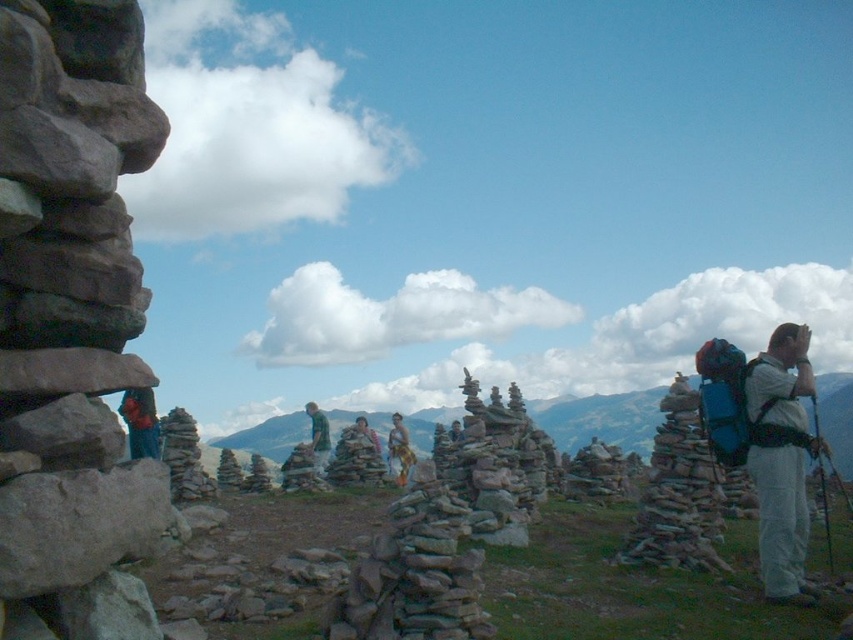
Question: Does white matte backpack at right have a larger size compared to blue fabric backpack at left?

Choices:
 (A) yes
 (B) no

Answer: (B)

Question: Estimate the real-world distances between objects in this image. Which object is farther from the white matte backpack at right?

Choices:
 (A) blue fabric backpack at left
 (B) gray stone stack at left
 (C) camouflage fabric jacket at center
 (D) camouflage fabric pants at center

Answer: (C)

Question: Does white matte backpack at right appear under camouflage fabric pants at center?

Choices:
 (A) no
 (B) yes

Answer: (A)

Question: Which point is farther to the camera?

Choices:
 (A) camouflage fabric jacket at center
 (B) gray stone stack at left
 (C) camouflage fabric pants at center

Answer: (A)

Question: Which point is closer to the camera?

Choices:
 (A) green fabric shirt at center
 (B) camouflage fabric jacket at center
 (C) camouflage fabric pants at center

Answer: (A)

Question: Can you confirm if white matte backpack at right is thinner than camouflage fabric pants at center?

Choices:
 (A) yes
 (B) no

Answer: (A)